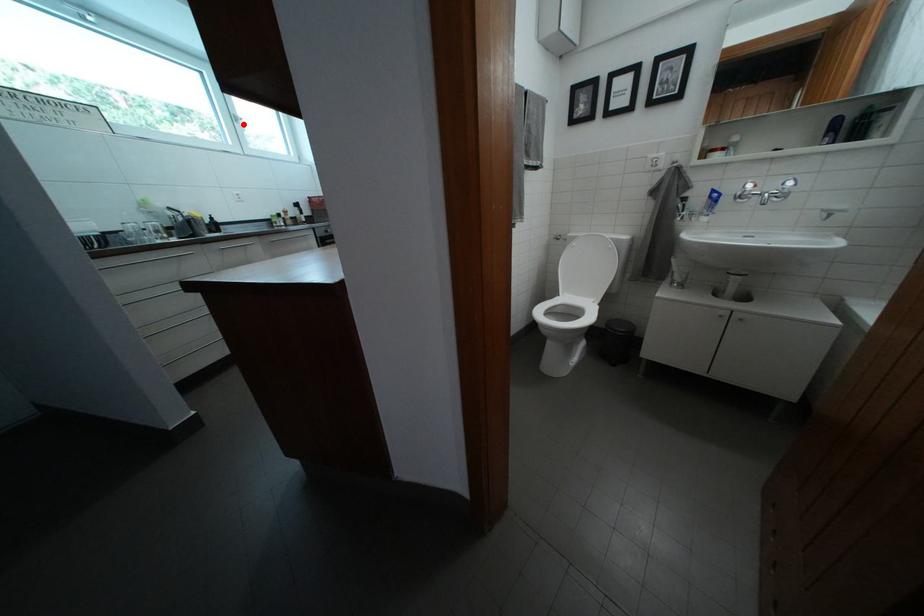
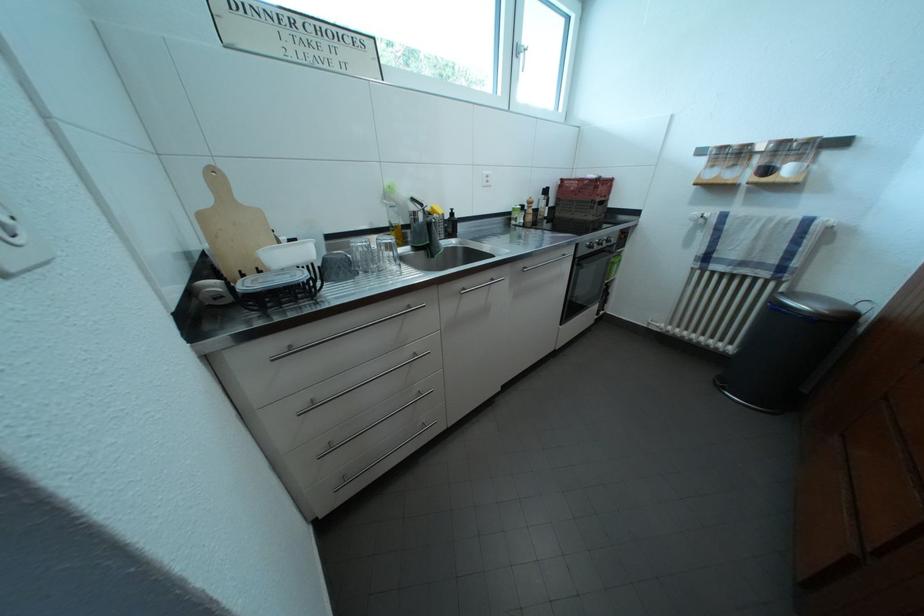
Find the pixel in the second image that matches the highlighted location in the first image.

(525, 55)